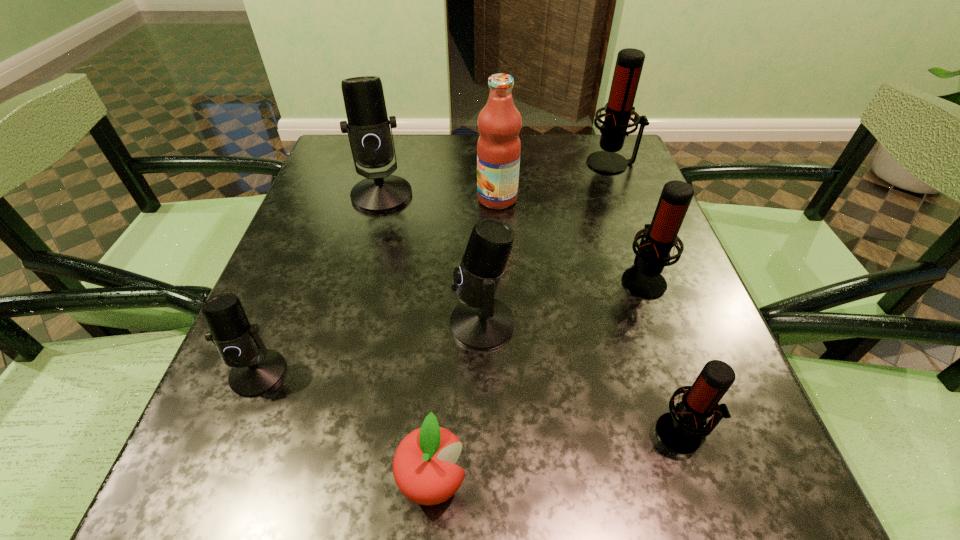
What are the coordinates of `free spot between the red apple and the farthest black microphone` in the screenshot? It's located at (407, 338).

You are a GUI agent. You are given a task and a screenshot of the screen. Output one action in this format:
    pyautogui.click(x=<x>, y=<y>)
    Task: Click on the free area in between the rightmost black microphone and the biggest red microphone
    The height and width of the screenshot is (540, 960).
    Given the screenshot: What is the action you would take?
    pyautogui.click(x=547, y=244)

Identify the location of empty location between the third farthest microphone and the fruit juice. (570, 239).

Locate an element on the screen. vacant area that lies between the fruit juice and the farthest black microphone is located at coordinates (440, 197).

Identify the location of free space between the fruit juice and the second microphone from left to right. (440, 197).

Find the location of a particular element. The height and width of the screenshot is (540, 960). the third closest object relative to the third microphone from left to right is located at coordinates (681, 431).

Identify the location of object that stands as the closest to the biggest red microphone. (499, 147).

Where is `the second closest microphone to the biggest black microphone`? The height and width of the screenshot is (540, 960). the second closest microphone to the biggest black microphone is located at coordinates (255, 370).

Identify which microphone is the nearest to the nearest black microphone. Please provide its 2D coordinates. Your answer should be formatted as a tuple, i.e. [(x, y)], where the tuple contains the x and y coordinates of a point satisfying the conditions above.

[(480, 322)]

Identify which red microphone is located as the second nearest to the farthest microphone. Please provide its 2D coordinates. Your answer should be formatted as a tuple, i.e. [(x, y)], where the tuple contains the x and y coordinates of a point satisfying the conditions above.

[(681, 431)]